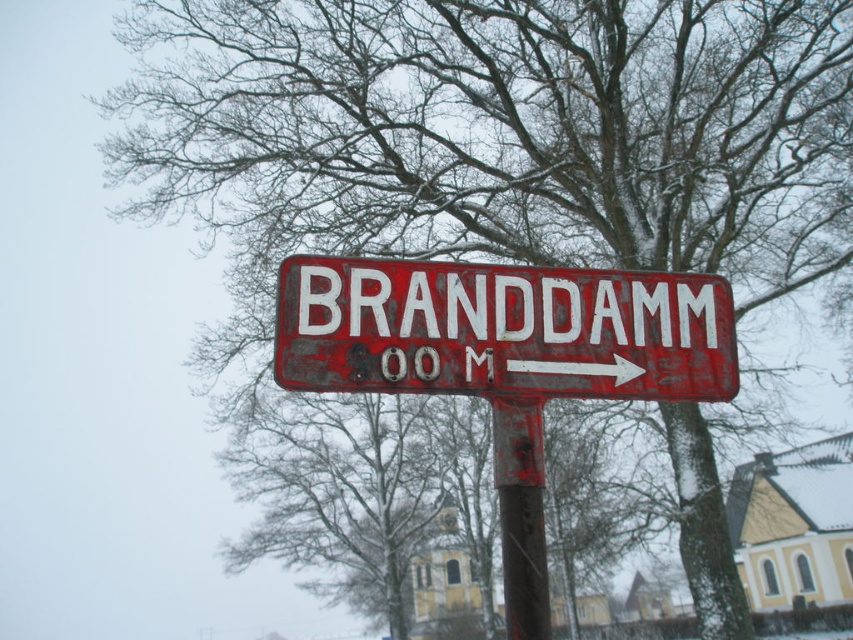
From the picture: You are a delivery driver who needs to attach a new sign to the pole. The new sign is the same size as the rusty metal pole at center. Will the new sign be smaller than the existing rusty metal sign at center?

The rusty metal sign at center has a larger size compared to the rusty metal pole at center. Therefore, the new sign, being the same size as the pole, will indeed be smaller than the existing rusty metal sign at center.